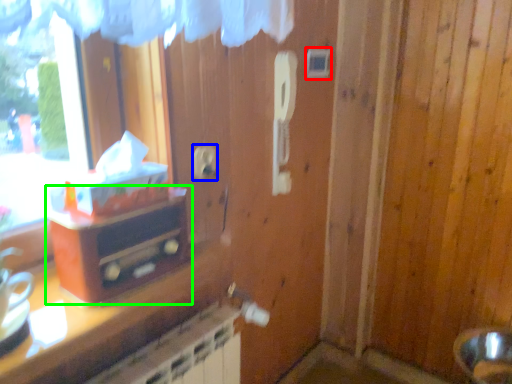
Question: Which is farther away from light switch (highlighted by a red box)? electric outlet (highlighted by a blue box) or furniture (highlighted by a green box)?

Choices:
 (A) electric outlet
 (B) furniture

Answer: (B)